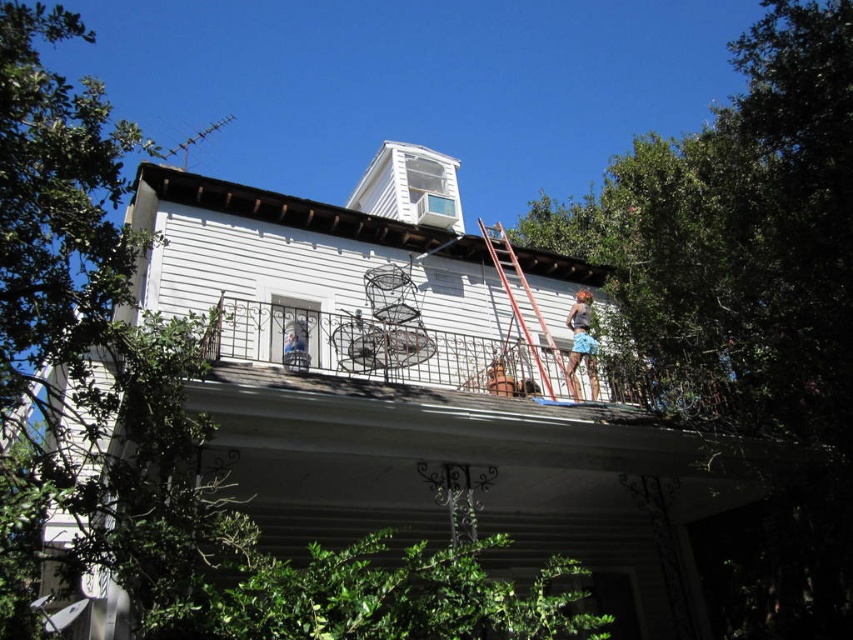
Question: Which point is closer to the camera?

Choices:
 (A) blue fabric shorts at upper right
 (B) brown leather bag at center

Answer: (B)

Question: Among these points, which one is nearest to the camera?

Choices:
 (A) (x=558, y=372)
 (B) (x=492, y=364)
 (C) (x=595, y=397)

Answer: (B)

Question: Considering the relative positions of blue fabric shorts at upper right and brown leather bag at center in the image provided, where is blue fabric shorts at upper right located with respect to brown leather bag at center?

Choices:
 (A) above
 (B) below

Answer: (A)

Question: Considering the relative positions of rustic wood ladder at upper center and blue fabric shorts at upper right in the image provided, where is rustic wood ladder at upper center located with respect to blue fabric shorts at upper right?

Choices:
 (A) above
 (B) below

Answer: (A)

Question: Can you confirm if blue fabric shorts at upper right is positioned above brown leather bag at center?

Choices:
 (A) yes
 (B) no

Answer: (A)

Question: Which of these objects is positioned farthest from the brown leather bag at center?

Choices:
 (A) blue fabric shorts at upper right
 (B) rustic wood ladder at upper center

Answer: (A)